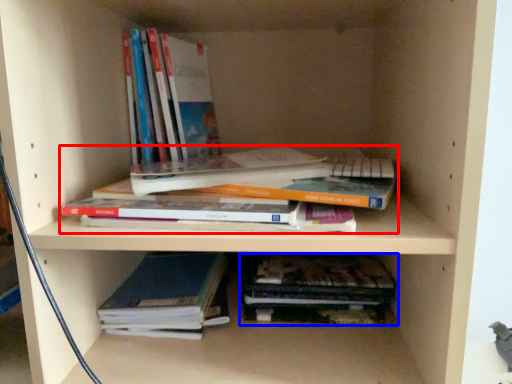
Question: Which point is closer to the camera, book (highlighted by a red box) or book (highlighted by a blue box)?

Choices:
 (A) book
 (B) book

Answer: (A)